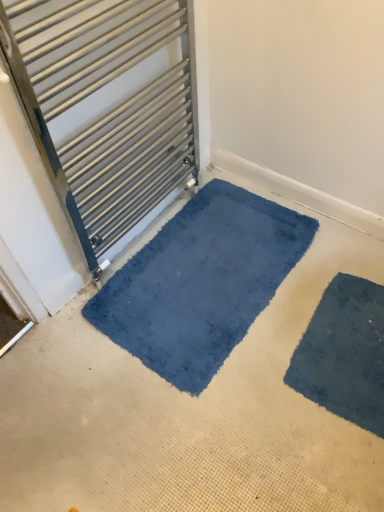
What are the coordinates of `free point above dark blue plush bath mat at lower right (from a real-world perspective)` in the screenshot? It's located at (352, 344).